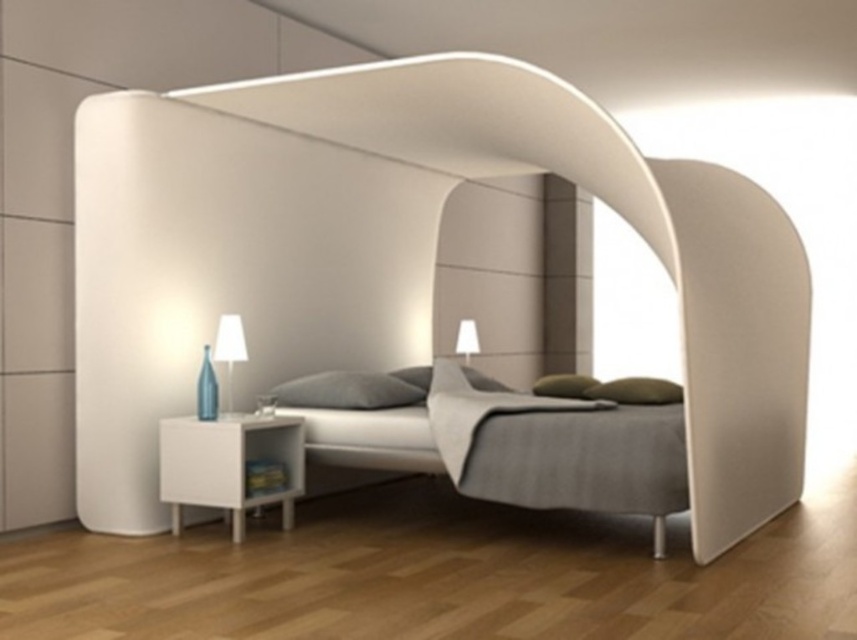
Can you confirm if gray soft pillow at center is positioned above gray fabric pillow at center?

No, gray soft pillow at center is not above gray fabric pillow at center.

In order to click on gray soft pillow at center in this screenshot , I will do click(x=352, y=388).

Is white matte bed canopy at center shorter than gray soft pillow at center?

No.

Can you confirm if white matte bed canopy at center is positioned above gray soft pillow at center?

Indeed, white matte bed canopy at center is positioned over gray soft pillow at center.

What do you see at coordinates (292, 232) in the screenshot? I see `white matte bed canopy at center` at bounding box center [292, 232].

You are a GUI agent. You are given a task and a screenshot of the screen. Output one action in this format:
    pyautogui.click(x=<x>, y=<y>)
    Task: Click on the white matte bed canopy at center
    
    Given the screenshot: What is the action you would take?
    pyautogui.click(x=292, y=232)

Is point (462, 468) closer to camera compared to point (496, 385)?

Yes, point (462, 468) is closer to viewer.

Who is positioned more to the left, gray fabric bed at center or gray fabric pillow at center?

Positioned to the left is gray fabric pillow at center.

Identify the location of gray fabric bed at center. The height and width of the screenshot is (640, 857). (518, 445).